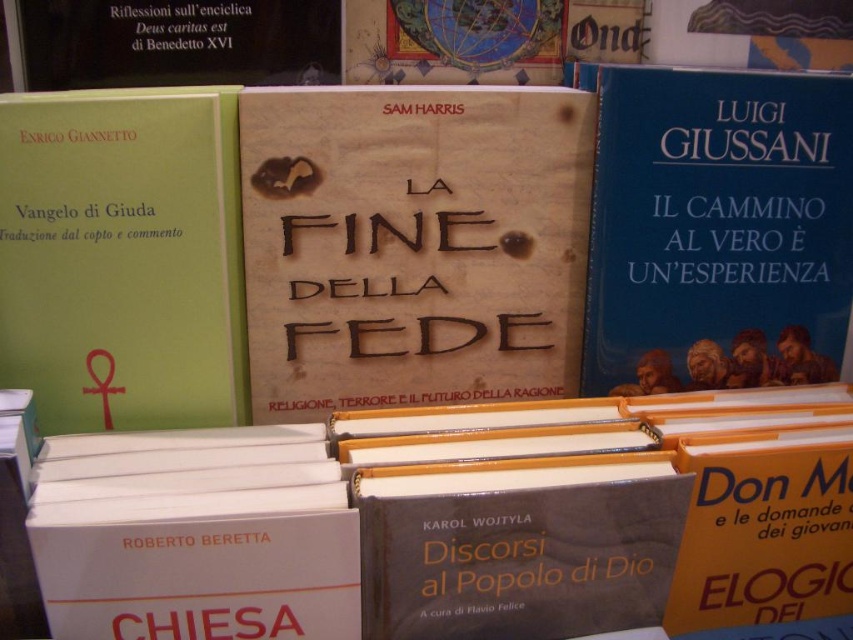
Which is below, beige paper book at center or blue matte book at right?

Positioned lower is beige paper book at center.

Consider the image. Who is shorter, beige paper book at center or blue matte book at right?

Standing shorter between the two is beige paper book at center.

Between point (585, 209) and point (706, 109), which one is positioned in front?

Point (706, 109)

Locate an element on the screen. This screenshot has width=853, height=640. beige paper book at center is located at coordinates (412, 244).

Is blue matte book at right to the right of green matte book at left from the viewer's perspective?

Yes, blue matte book at right is to the right of green matte book at left.

Which is behind, point (628, 260) or point (158, 344)?

The point (628, 260) is behind.

Which is in front, point (825, 202) or point (171, 371)?

Point (171, 371)

Identify the location of blue matte book at right. (717, 228).

Can you confirm if beige paper book at center is thinner than green matte book at left?

Incorrect, beige paper book at center's width is not less than green matte book at left's.

Can you confirm if beige paper book at center is positioned to the right of green matte book at left?

Yes, beige paper book at center is to the right of green matte book at left.

Is point (247, 337) closer to camera compared to point (71, 292)?

No, (247, 337) is further to viewer.

The height and width of the screenshot is (640, 853). What are the coordinates of `beige paper book at center` in the screenshot? It's located at (412, 244).